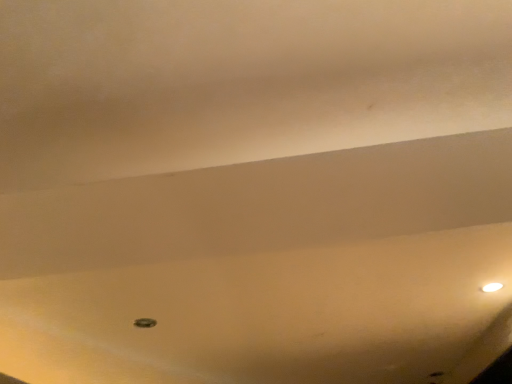
Describe the element at coordinates (492, 287) in the screenshot. This screenshot has width=512, height=384. I see `white glossy lamp at upper right` at that location.

The height and width of the screenshot is (384, 512). I want to click on white glossy lamp at upper right, so [492, 287].

You are a GUI agent. You are given a task and a screenshot of the screen. Output one action in this format:
    pyautogui.click(x=<x>, y=<y>)
    Task: Click on the white glossy lamp at upper right
    The image size is (512, 384).
    Given the screenshot: What is the action you would take?
    pyautogui.click(x=492, y=287)